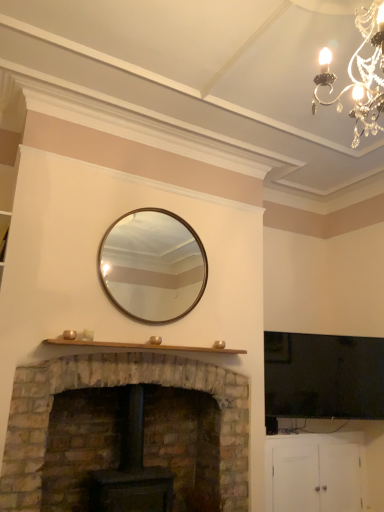
Question: Is crystal chandelier at upper right not within rustic stone fireplace at lower left?

Choices:
 (A) yes
 (B) no

Answer: (A)

Question: Does crystal chandelier at upper right come in front of rustic stone fireplace at lower left?

Choices:
 (A) no
 (B) yes

Answer: (B)

Question: From the image's perspective, would you say crystal chandelier at upper right is positioned over rustic stone fireplace at lower left?

Choices:
 (A) yes
 (B) no

Answer: (A)

Question: From a real-world perspective, is crystal chandelier at upper right on rustic stone fireplace at lower left?

Choices:
 (A) no
 (B) yes

Answer: (B)

Question: Can you confirm if crystal chandelier at upper right is positioned to the left of rustic stone fireplace at lower left?

Choices:
 (A) no
 (B) yes

Answer: (A)

Question: Looking at their shapes, would you say rustic stone fireplace at lower left is wider or thinner than crystal chandelier at upper right?

Choices:
 (A) thin
 (B) wide

Answer: (B)

Question: Is rustic stone fireplace at lower left to the left or to the right of crystal chandelier at upper right in the image?

Choices:
 (A) right
 (B) left

Answer: (B)

Question: Looking at the image, does rustic stone fireplace at lower left seem bigger or smaller compared to crystal chandelier at upper right?

Choices:
 (A) small
 (B) big

Answer: (B)

Question: Does point (26, 496) appear closer or farther from the camera than point (321, 86)?

Choices:
 (A) closer
 (B) farther

Answer: (A)

Question: From the image's perspective, relative to white matte cabinet at lower right, is rustic stone fireplace at lower left above or below?

Choices:
 (A) below
 (B) above

Answer: (B)

Question: Based on their positions, is rustic stone fireplace at lower left located to the left or right of white matte cabinet at lower right?

Choices:
 (A) right
 (B) left

Answer: (B)

Question: From a real-world perspective, relative to white matte cabinet at lower right, is rustic stone fireplace at lower left vertically above or below?

Choices:
 (A) above
 (B) below

Answer: (A)

Question: Based on their sizes in the image, would you say rustic stone fireplace at lower left is bigger or smaller than white matte cabinet at lower right?

Choices:
 (A) big
 (B) small

Answer: (A)

Question: Choose the correct answer: Is silver metallic mirror at center inside rustic stone fireplace at lower left or outside it?

Choices:
 (A) outside
 (B) inside

Answer: (A)

Question: From a real-world perspective, relative to rustic stone fireplace at lower left, is silver metallic mirror at center vertically above or below?

Choices:
 (A) below
 (B) above

Answer: (B)